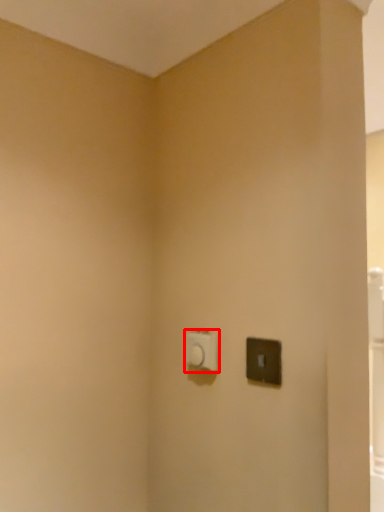
Question: Considering the relative positions of light switch (annotated by the red box) and light switch in the image provided, where is light switch (annotated by the red box) located with respect to the staircase?

Choices:
 (A) right
 (B) left

Answer: (B)